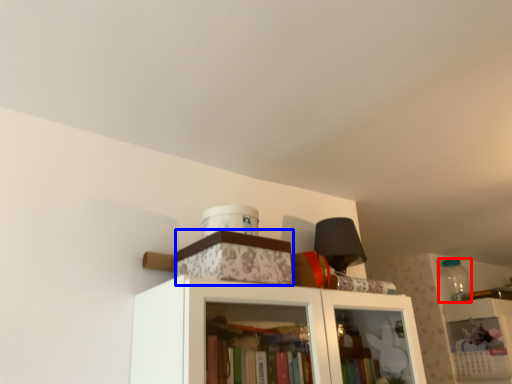
Question: Which object appears farthest to the camera in this image, bottle (highlighted by a red box) or cabinetry (highlighted by a blue box)?

Choices:
 (A) bottle
 (B) cabinetry

Answer: (A)